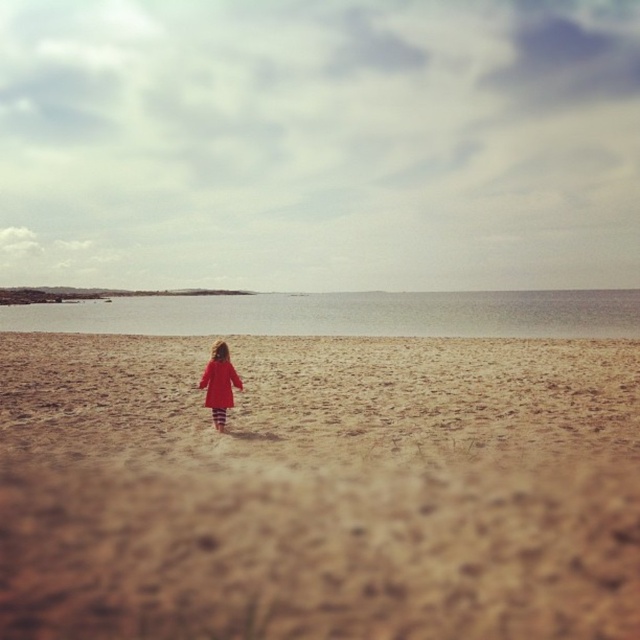
You are a photographer trying to capture the child in the matte red coat at center while ensuring the brown sandy beach at center is visible in the background. Based on their relative heights, will the beach appear smaller than the coat in the photo?

The brown sandy beach at center is shorter than the matte red coat at center, so in the photo, the beach will appear smaller than the coat.

You are a photographer planning to capture the entire beach scene in one shot. Given that the brown sandy beach at center and the clear water at center are both in the frame, which area would require a wider angle to fully include in the photo?

The clear water at center requires a wider angle because its width is greater than the brown sandy beach at center.